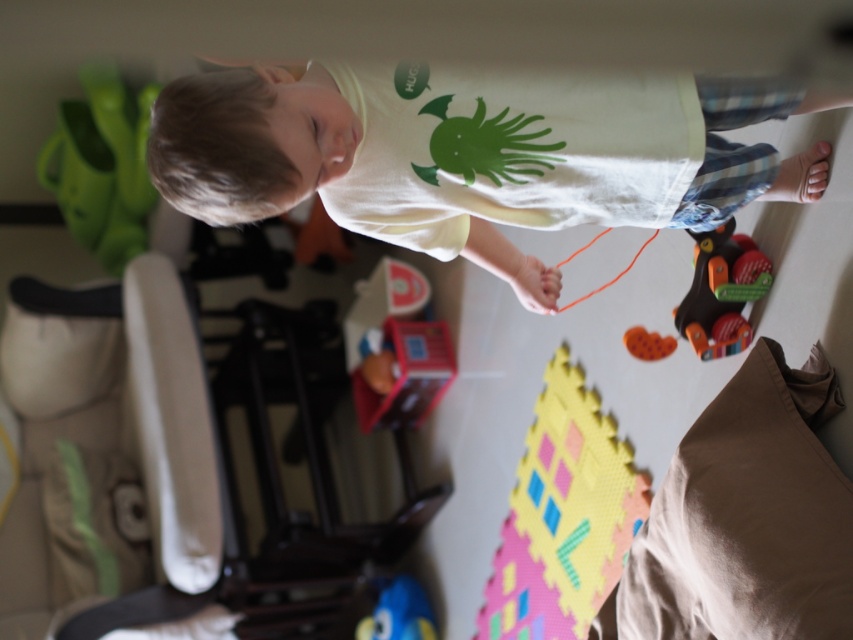
Question: In this image, where is rubberized plastic toy at right located relative to orange string at lower center?

Choices:
 (A) right
 (B) left

Answer: (A)

Question: Based on their relative distances, which object is farther from the blue rubber duck at lower center?

Choices:
 (A) rubberized plastic toy at right
 (B) orange string at lower center
 (C) orange rubber toy at lower center

Answer: (A)

Question: Which point is farther to the camera?

Choices:
 (A) white matte shirt at center
 (B) rubberized plastic toy at right
 (C) orange string at lower center

Answer: (C)

Question: From the image, what is the correct spatial relationship of white matte shirt at center in relation to beige soft pillow at lower right?

Choices:
 (A) below
 (B) above

Answer: (B)

Question: Which object is the closest to the blue rubber duck at lower center?

Choices:
 (A) beige soft pillow at lower right
 (B) rubberized foam puzzle piece at lower center
 (C) orange string at lower center
 (D) white matte shirt at center

Answer: (B)

Question: Can you confirm if beige soft pillow at lower right is positioned below blue rubber duck at lower center?

Choices:
 (A) no
 (B) yes

Answer: (A)